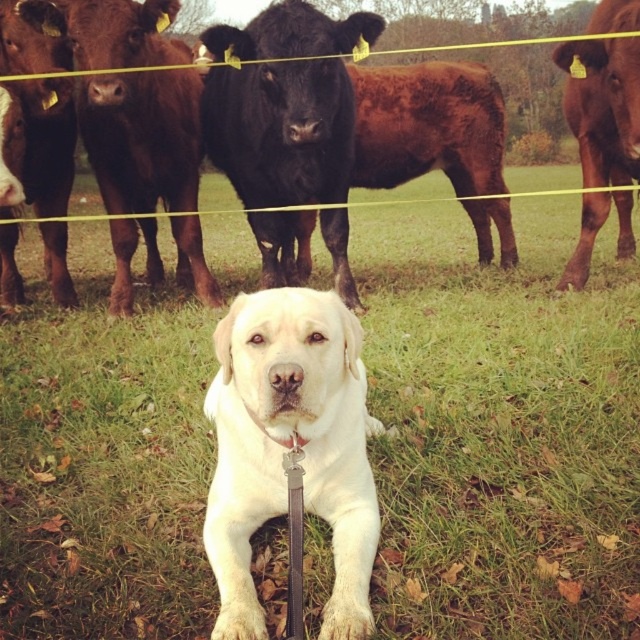
Is brown glossy bull at right shorter than brown glossy cow at left?

In fact, brown glossy bull at right may be taller than brown glossy cow at left.

Consider the image. Is the position of brown glossy bull at right more distant than that of brown glossy cow at left?

No, brown glossy bull at right is closer to the viewer.

Find the location of `brown glossy bull at right`. brown glossy bull at right is located at coordinates point(604,108).

In order to click on brown glossy bull at right in this screenshot , I will do `click(604, 108)`.

Who is higher up, green grass at center or brown glossy bull at right?

green grass at center is above.

Is green grass at center to the left of brown glossy bull at right from the viewer's perspective?

Yes, green grass at center is to the left of brown glossy bull at right.

Who is more forward, (164, 618) or (609, 74)?

Point (164, 618) is in front.

Find the location of a particular element. green grass at center is located at coordinates (500, 428).

Is black glossy bull at center in front of brown glossy bull at left?

Yes, black glossy bull at center is closer to the viewer.

Does point (273, 86) lie in front of point (188, 92)?

Yes, point (273, 86) is closer to viewer.

Locate an element on the screen. Image resolution: width=640 pixels, height=640 pixels. black glossy bull at center is located at coordinates (282, 131).